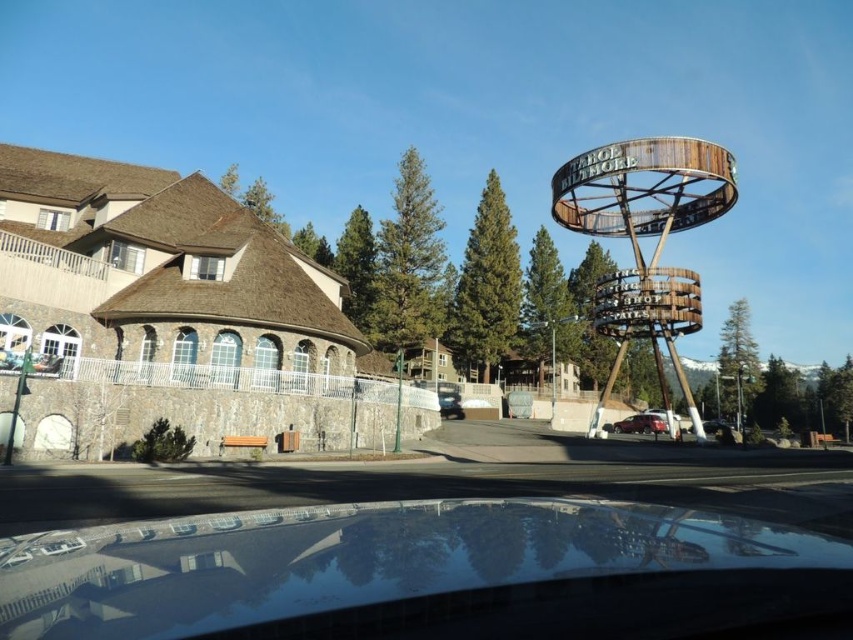
Question: Is metallic maroon car at center-right bigger than black glossy car at lower center?

Choices:
 (A) no
 (B) yes

Answer: (A)

Question: Observing the image, what is the correct spatial positioning of metallic maroon car at center-right in reference to metallic silver car at center?

Choices:
 (A) above
 (B) below

Answer: (B)

Question: From the image, what is the correct spatial relationship of metallic silver car at center in relation to black glossy car at lower center?

Choices:
 (A) below
 (B) above

Answer: (B)

Question: Estimate the real-world distances between objects in this image. Which object is closer to the rustic wood sign at upper right?

Choices:
 (A) black glossy car at lower center
 (B) metallic maroon car at center-right
 (C) metallic silver car at center

Answer: (A)

Question: Which is farther from the metallic silver car at center?

Choices:
 (A) black glossy car at lower center
 (B) rustic wood sign at upper right

Answer: (A)

Question: Considering the real-world distances, which object is closest to the rustic wood sign at upper right?

Choices:
 (A) metallic maroon car at center-right
 (B) metallic silver car at center
 (C) black glossy car at lower center

Answer: (C)